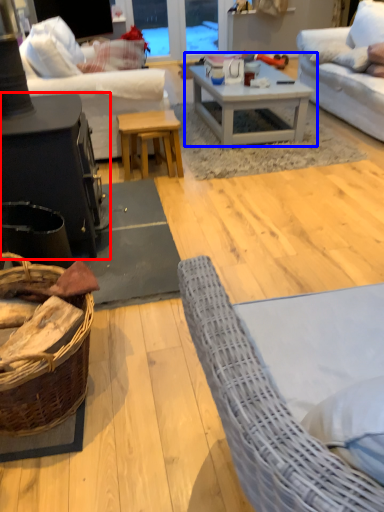
Question: Which object is closer to the camera taking this photo, table (highlighted by a red box) or coffee table (highlighted by a blue box)?

Choices:
 (A) table
 (B) coffee table

Answer: (A)